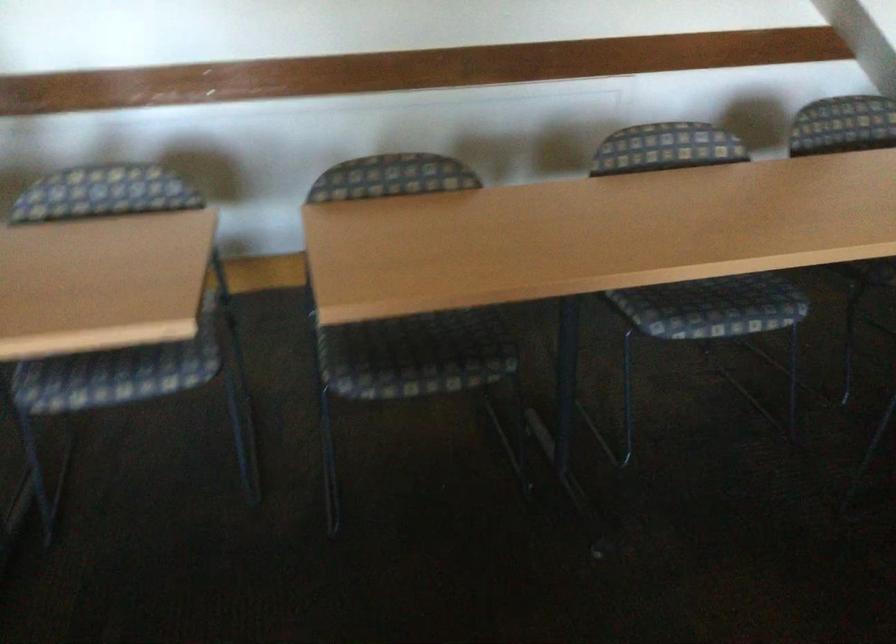
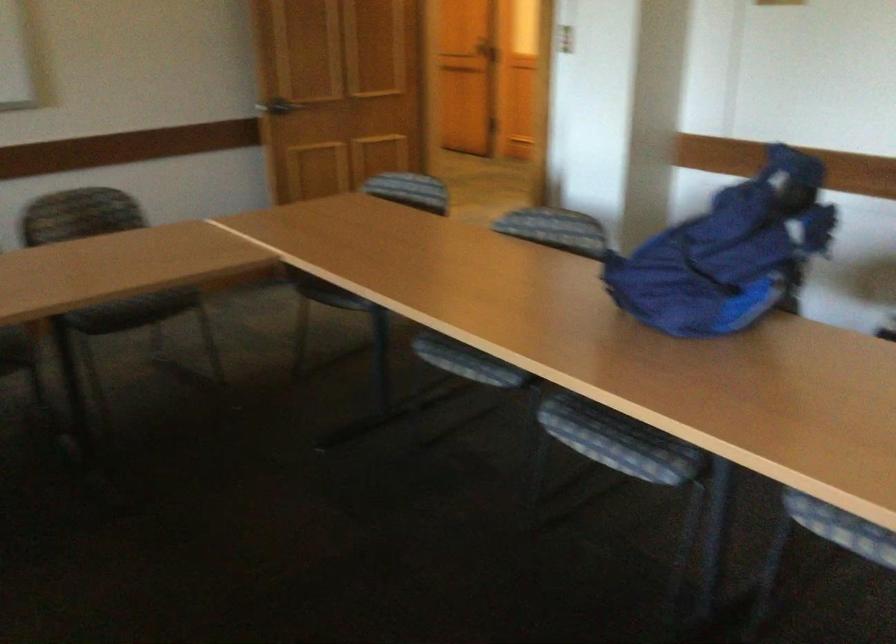
Where in the second image is the point corresponding to pixel 73 392 from the first image?

(840, 527)